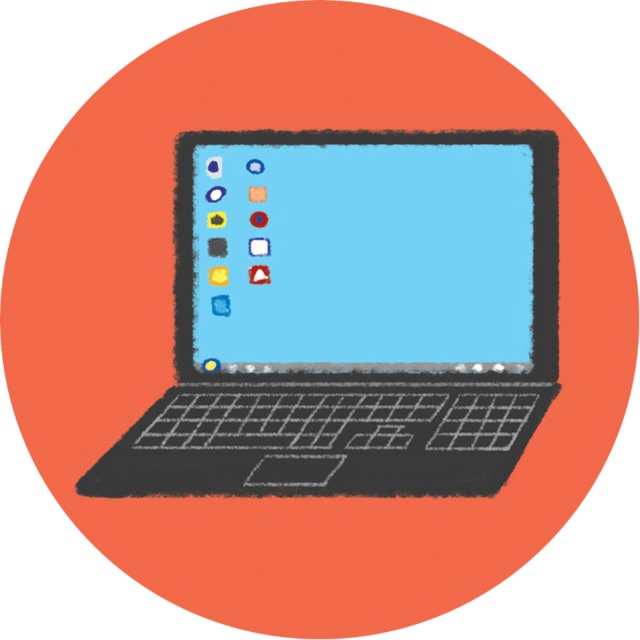
Question: Can you confirm if matte black laptop at center is positioned to the left of matte plastic screen at center?

Choices:
 (A) no
 (B) yes

Answer: (B)

Question: Which point appears farthest from the camera in this image?

Choices:
 (A) (214, 273)
 (B) (300, 468)

Answer: (A)

Question: Where is matte black laptop at center located in relation to matte plastic screen at center in the image?

Choices:
 (A) below
 (B) above

Answer: (A)

Question: Which of the following is the closest to the observer?

Choices:
 (A) (333, 188)
 (B) (541, 376)

Answer: (B)

Question: Can you confirm if matte black laptop at center is positioned to the right of matte plastic screen at center?

Choices:
 (A) no
 (B) yes

Answer: (A)